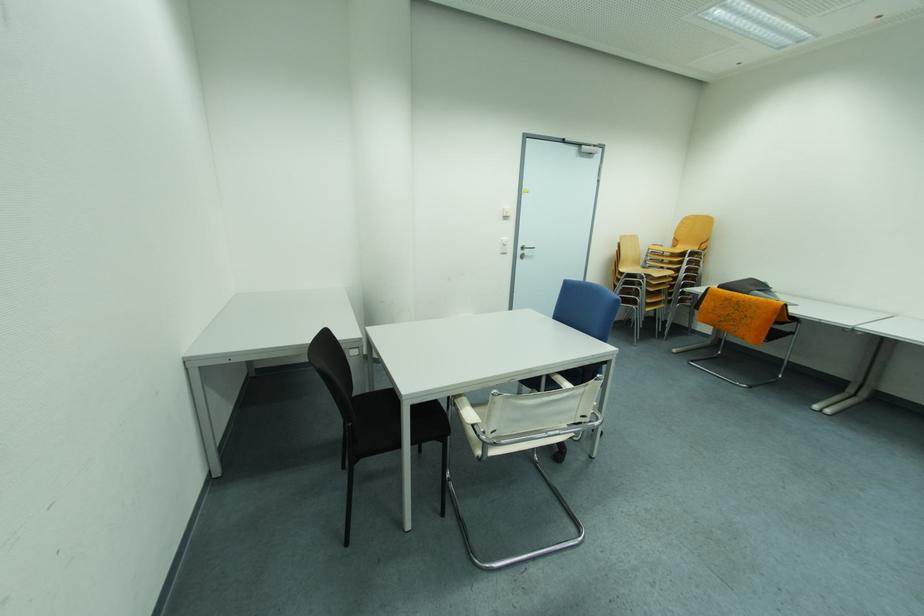
Identify the location of black chair sitting surface. The width and height of the screenshot is (924, 616). (377, 421).